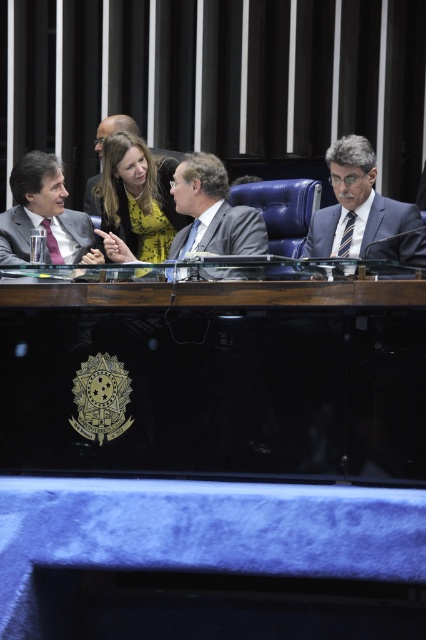
Question: Which object is closer to the camera taking this photo?

Choices:
 (A) matte gray suit at center
 (B) dark gray suit at center
 (C) black polished wood table at center

Answer: (C)

Question: Is matte gray suit at center closer to the viewer compared to matte black suit at left?

Choices:
 (A) yes
 (B) no

Answer: (B)

Question: Where is matte gray suit at center located in relation to dark gray suit at center in the image?

Choices:
 (A) above
 (B) below

Answer: (A)

Question: Which is farther from the black polished wood table at center?

Choices:
 (A) dark blue suit at right
 (B) matte black suit at center
 (C) matte gray suit at center
 (D) matte black suit at left

Answer: (B)

Question: Is matte gray suit at center smaller than dark blue suit at right?

Choices:
 (A) no
 (B) yes

Answer: (A)

Question: Which point is farther to the camera?

Choices:
 (A) (253, 248)
 (B) (5, 237)
 (C) (229, 232)

Answer: (B)